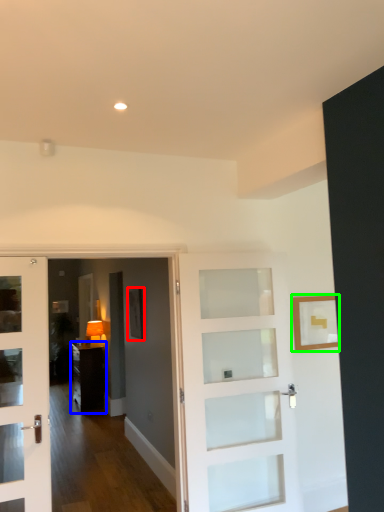
Question: Which object is positioned farthest from picture frame (highlighted by a red box)? Select from furniture (highlighted by a blue box) and picture frame (highlighted by a green box).

Choices:
 (A) furniture
 (B) picture frame

Answer: (A)